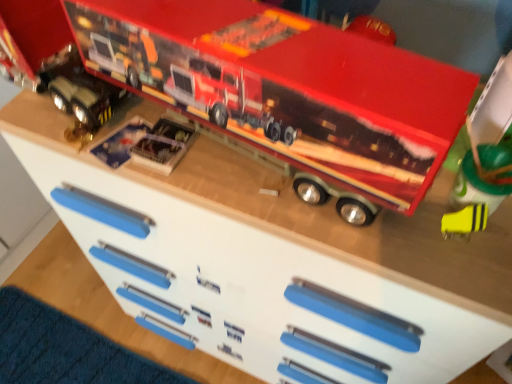
Find the location of a particular element. The height and width of the screenshot is (384, 512). empty space that is in between metallic silver toy truck at center, arranged as the 1th toy when viewed from the left, and yellow matte eraser at lower right, placed as the first toy when sorted from right to left is located at coordinates pos(282,196).